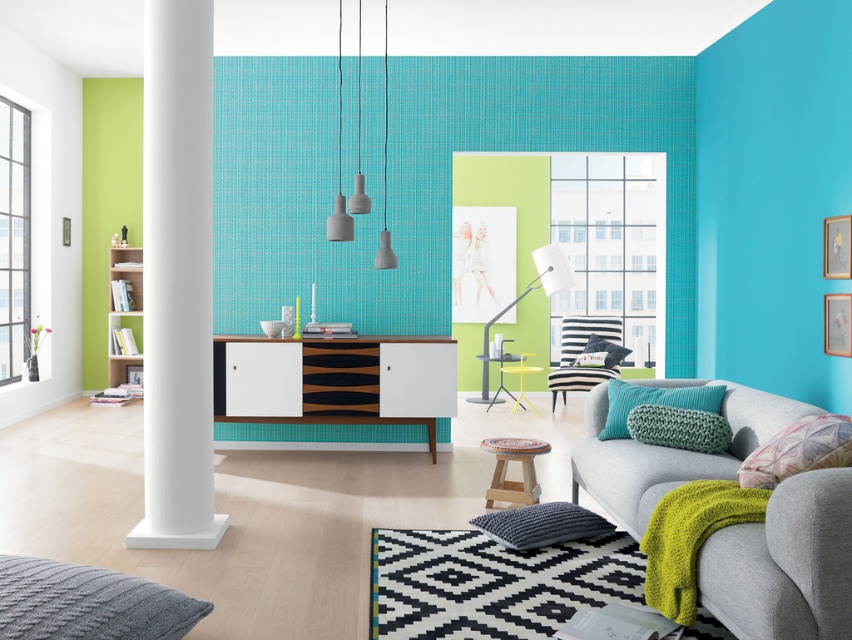
You are standing in the living room and want to move closer to the white smooth column at left. If you take three steps forward, each step covering 2.5 feet, will you reach the column?

The white smooth column at left is 13.51 feet away. Taking three steps of 2.5 feet each would cover 7.5 feet, so you are still 6.01 feet away from the column.

You are standing in the living room and want to move from the white smooth column at left to the gray fabric couch at lower right. Which direction should you move to reach the couch?

You should move to the right to reach the gray fabric couch at lower right from the white smooth column at left since the white smooth column at left is positioned to the left of the gray fabric couch at lower right.